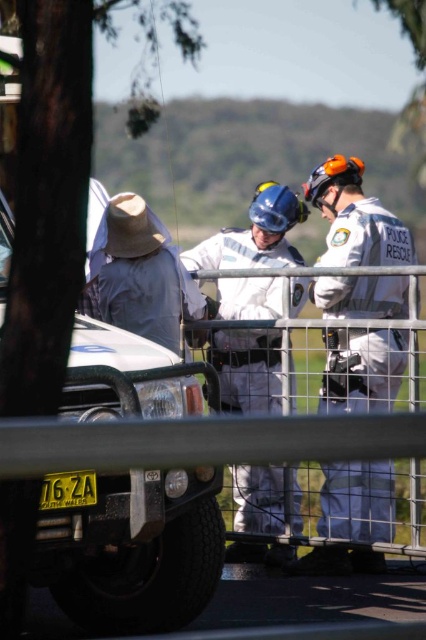
Question: Which object is farther from the camera taking this photo?

Choices:
 (A) matte white vehicle at left
 (B) white matte uniform at center

Answer: (B)

Question: Can you confirm if matte white vehicle at left is smaller than white matte uniform at center?

Choices:
 (A) yes
 (B) no

Answer: (A)

Question: Which point is closer to the camera taking this photo?

Choices:
 (A) (354, 378)
 (B) (3, 284)

Answer: (B)

Question: Is matte white vehicle at left above white matte uniform at center?

Choices:
 (A) yes
 (B) no

Answer: (B)

Question: Can you confirm if matte white vehicle at left is thinner than white matte uniform at center?

Choices:
 (A) no
 (B) yes

Answer: (A)